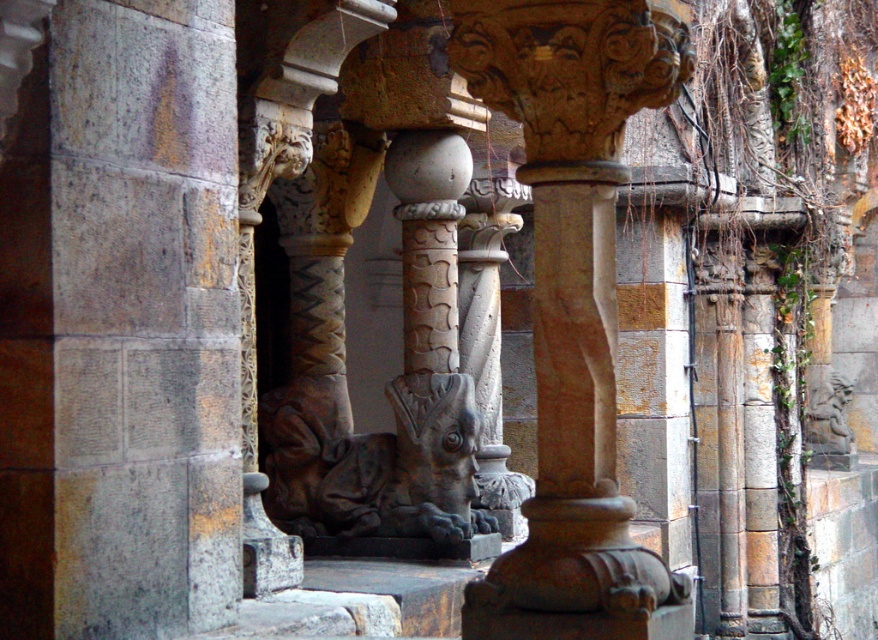
You are an architect examining the structure and want to walk from the gray stone pillar at left to the smooth stone column at center. Which direction should you move relative to the pillars?

You should move towards the smooth stone column at center because it is farther away from you than the gray stone pillar at left.

You are an architect analyzing the symmetry of the columns in the image. The central column is marked by point (x=573, y=305). Is this point exactly at the center of the image?

The smooth stone column at center is represented by point (x=573, y=305), so yes, this point is exactly at the center of the image.